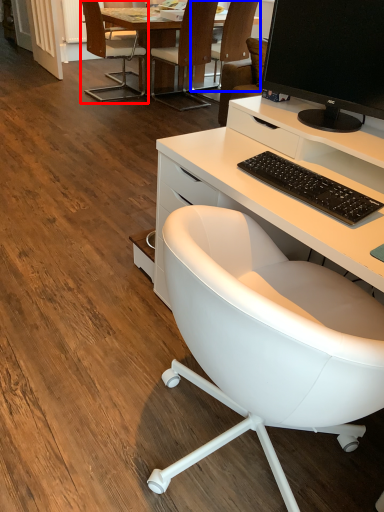
Question: Among these objects, which one is farthest to the camera, chair (highlighted by a red box) or chair (highlighted by a blue box)?

Choices:
 (A) chair
 (B) chair

Answer: (B)